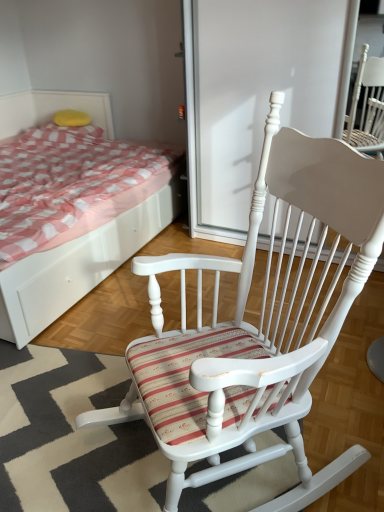
Question: Is yellow sponge at upper left far away from white wood screen door at center?

Choices:
 (A) no
 (B) yes

Answer: (B)

Question: Is yellow sponge at upper left at the left side of white wood screen door at center?

Choices:
 (A) no
 (B) yes

Answer: (B)

Question: Considering the relative positions of yellow sponge at upper left and white wood screen door at center in the image provided, is yellow sponge at upper left in front of white wood screen door at center?

Choices:
 (A) yes
 (B) no

Answer: (B)

Question: From the image's perspective, is yellow sponge at upper left located beneath white wood screen door at center?

Choices:
 (A) yes
 (B) no

Answer: (B)

Question: Is yellow sponge at upper left at the right side of white wood screen door at center?

Choices:
 (A) yes
 (B) no

Answer: (B)

Question: In terms of size, does white wood bed at upper left appear bigger or smaller than white wood rocking chair at center?

Choices:
 (A) small
 (B) big

Answer: (B)

Question: From their relative heights in the image, would you say white wood bed at upper left is taller or shorter than white wood rocking chair at center?

Choices:
 (A) short
 (B) tall

Answer: (A)

Question: From the image's perspective, is white wood bed at upper left located above or below white wood rocking chair at center?

Choices:
 (A) above
 (B) below

Answer: (A)

Question: Based on their positions, is white wood bed at upper left located to the left or right of white wood rocking chair at center?

Choices:
 (A) right
 (B) left

Answer: (B)

Question: Looking at their shapes, would you say yellow sponge at upper left is wider or thinner than white wood screen door at center?

Choices:
 (A) thin
 (B) wide

Answer: (A)

Question: From the image's perspective, relative to white wood screen door at center, is yellow sponge at upper left above or below?

Choices:
 (A) above
 (B) below

Answer: (A)

Question: In the image, is yellow sponge at upper left positioned in front of or behind white wood screen door at center?

Choices:
 (A) front
 (B) behind

Answer: (B)

Question: Choose the correct answer: Is yellow sponge at upper left inside white wood screen door at center or outside it?

Choices:
 (A) inside
 (B) outside

Answer: (B)

Question: Is white wood rocking chair at center taller or shorter than yellow sponge at upper left?

Choices:
 (A) short
 (B) tall

Answer: (B)

Question: Is white wood rocking chair at center in front of or behind yellow sponge at upper left in the image?

Choices:
 (A) front
 (B) behind

Answer: (A)